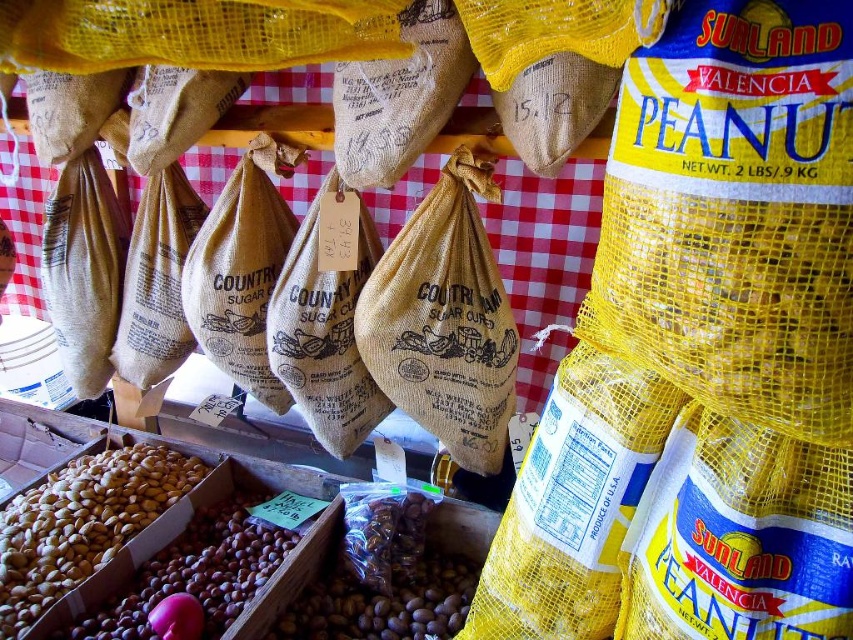
Does brown matte nuts at lower left have a lesser height compared to brown matte nuts at center?

In fact, brown matte nuts at lower left may be taller than brown matte nuts at center.

This screenshot has width=853, height=640. Describe the element at coordinates (82, 524) in the screenshot. I see `brown matte nuts at lower left` at that location.

Which is in front, point (135, 483) or point (183, 589)?

Point (183, 589)

Where is `brown matte nuts at lower left`? This screenshot has height=640, width=853. brown matte nuts at lower left is located at coordinates (82, 524).